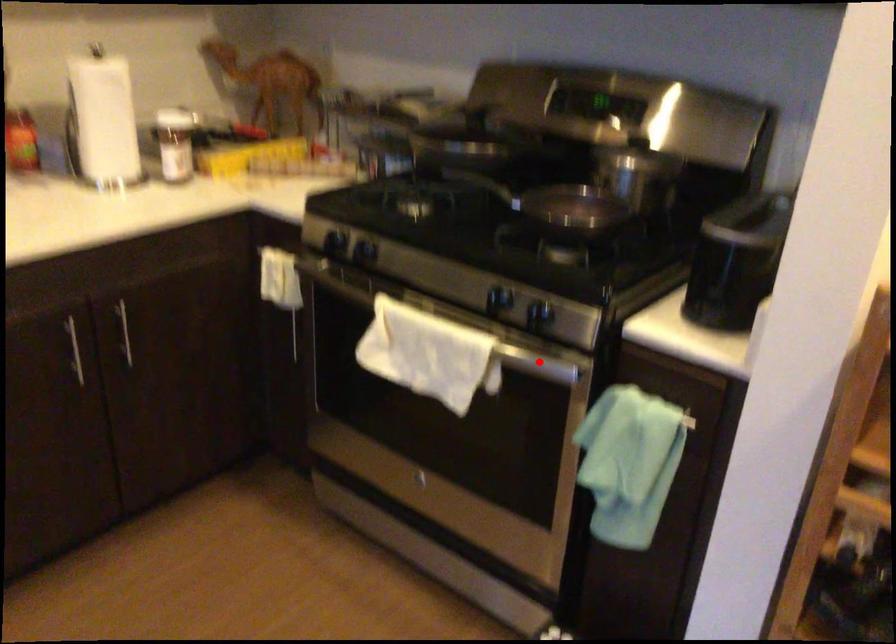
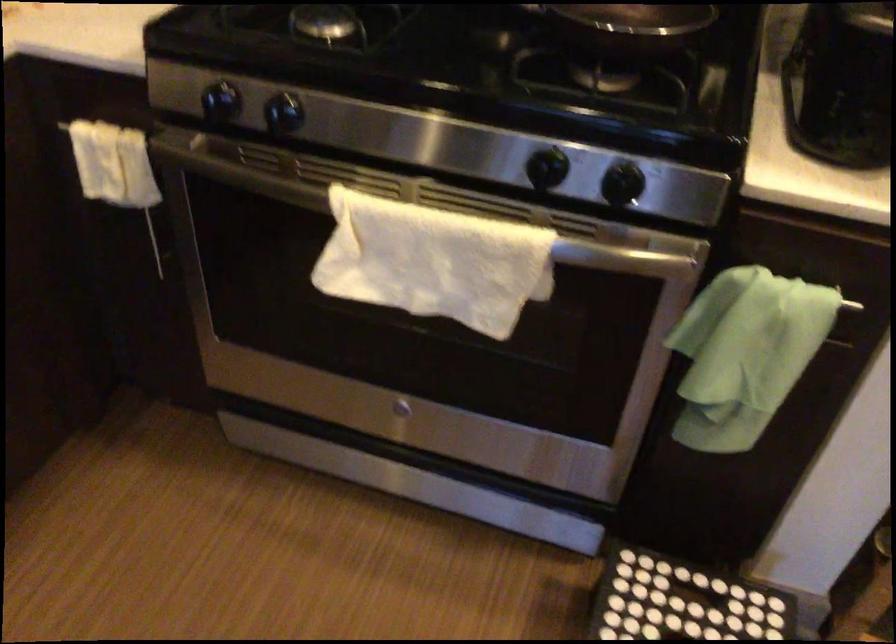
Where in the second image is the point corresponding to the highlighted location from the first image?

(618, 257)